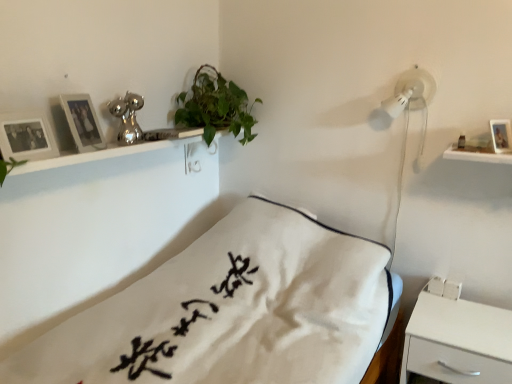
Question: Is wooden photo frame at upper left, the first picture frame in the left-to-right sequence, at the left side of green leafy plant at upper center?

Choices:
 (A) no
 (B) yes

Answer: (B)

Question: From the image's perspective, is wooden photo frame at upper left, the 3th picture frame from the right, on green leafy plant at upper center?

Choices:
 (A) no
 (B) yes

Answer: (A)

Question: Considering the relative sizes of wooden photo frame at upper left, the 3th picture frame from the right, and green leafy plant at upper center in the image provided, is wooden photo frame at upper left, the 3th picture frame from the right, thinner than green leafy plant at upper center?

Choices:
 (A) no
 (B) yes

Answer: (B)

Question: From a real-world perspective, is wooden photo frame at upper left, the first picture frame in the left-to-right sequence, positioned over green leafy plant at upper center based on gravity?

Choices:
 (A) no
 (B) yes

Answer: (A)

Question: Is wooden photo frame at upper left, the first picture frame in the left-to-right sequence, turned away from green leafy plant at upper center?

Choices:
 (A) yes
 (B) no

Answer: (B)

Question: From the image's perspective, is wooden photo frame at upper right, the 3th picture frame when ordered from left to right, positioned above or below white matte nightstand at lower right?

Choices:
 (A) above
 (B) below

Answer: (A)

Question: From a real-world perspective, relative to white matte nightstand at lower right, is wooden photo frame at upper right, which is the 1th picture frame in right-to-left order, vertically above or below?

Choices:
 (A) above
 (B) below

Answer: (A)

Question: Is wooden photo frame at upper right, which is the 1th picture frame in right-to-left order, in front of or behind white matte nightstand at lower right in the image?

Choices:
 (A) behind
 (B) front

Answer: (A)

Question: Looking at their shapes, would you say wooden photo frame at upper right, which is the 1th picture frame in right-to-left order, is wider or thinner than white matte nightstand at lower right?

Choices:
 (A) wide
 (B) thin

Answer: (B)

Question: From the image's perspective, is wooden photo frame at upper right, which is the 1th picture frame in right-to-left order, positioned above or below matte silver picture frame at upper left, which is counted as the 2th picture frame, starting from the right?

Choices:
 (A) below
 (B) above

Answer: (A)

Question: Would you say wooden photo frame at upper right, the 3th picture frame when ordered from left to right, is inside or outside matte silver picture frame at upper left, which ranks as the 2th picture frame in left-to-right order?

Choices:
 (A) outside
 (B) inside

Answer: (A)

Question: Is wooden photo frame at upper right, which is the 1th picture frame in right-to-left order, wider or thinner than matte silver picture frame at upper left, which ranks as the 2th picture frame in left-to-right order?

Choices:
 (A) thin
 (B) wide

Answer: (B)

Question: Considering the positions of wooden photo frame at upper right, the 3th picture frame when ordered from left to right, and matte silver picture frame at upper left, which is counted as the 2th picture frame, starting from the right, in the image, is wooden photo frame at upper right, the 3th picture frame when ordered from left to right, taller or shorter than matte silver picture frame at upper left, which is counted as the 2th picture frame, starting from the right,?

Choices:
 (A) tall
 (B) short

Answer: (B)

Question: Considering the positions of point (15, 137) and point (91, 114), is point (15, 137) closer or farther from the camera than point (91, 114)?

Choices:
 (A) farther
 (B) closer

Answer: (B)

Question: Is wooden photo frame at upper left, the first picture frame in the left-to-right sequence, wider or thinner than matte silver picture frame at upper left, which is counted as the 2th picture frame, starting from the right?

Choices:
 (A) thin
 (B) wide

Answer: (B)